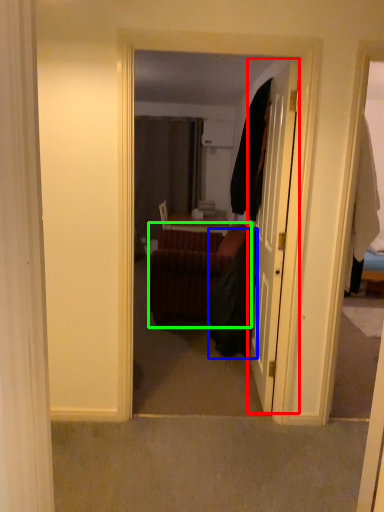
Question: Based on their relative distances, which object is nearer to door (highlighted by a red box)? Choose from robe (highlighted by a blue box) and studio couch (highlighted by a green box).

Choices:
 (A) robe
 (B) studio couch

Answer: (A)